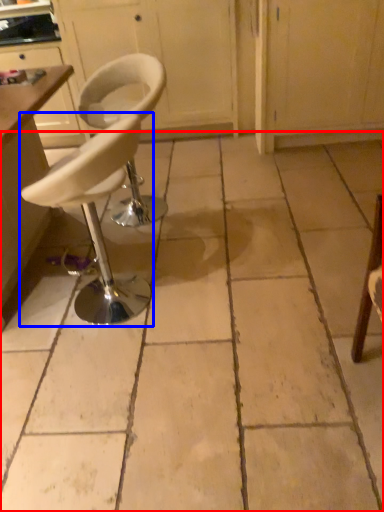
Question: Which object appears farthest to the camera in this image, concrete (highlighted by a red box) or chair (highlighted by a blue box)?

Choices:
 (A) concrete
 (B) chair

Answer: (B)